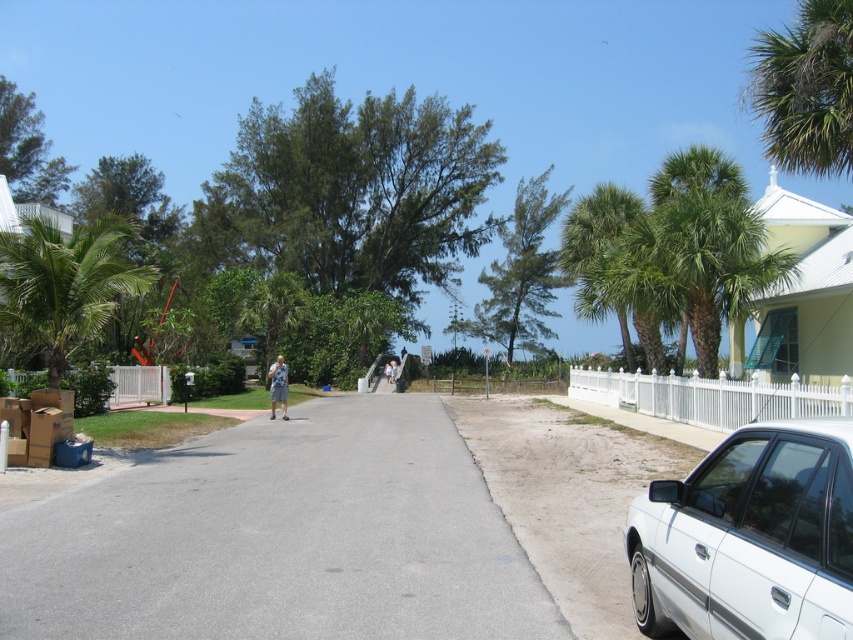
From the picture: Does light blue denim shorts at center lie behind white cotton shirt at center?

No, it is in front of white cotton shirt at center.

Who is more forward, (283, 381) or (392, 381)?

Positioned in front is point (283, 381).

Identify the location of light blue denim shorts at center. Image resolution: width=853 pixels, height=640 pixels. (277, 385).

Between green leafy palm tree at left and light blue denim shorts at center, which one is positioned lower?

light blue denim shorts at center

Is green leafy palm tree at left taller than light blue denim shorts at center?

Indeed, green leafy palm tree at left has a greater height compared to light blue denim shorts at center.

Where is `green leafy palm tree at left`? Image resolution: width=853 pixels, height=640 pixels. green leafy palm tree at left is located at coordinates (65, 284).

Between green leafy palm tree at upper right and green leafy palm tree at left, which one appears on the right side from the viewer's perspective?

green leafy palm tree at upper right

Which of these two, green leafy palm tree at upper right or green leafy palm tree at left, stands taller?

With more height is green leafy palm tree at upper right.

The image size is (853, 640). What are the coordinates of `green leafy palm tree at upper right` in the screenshot? It's located at (805, 90).